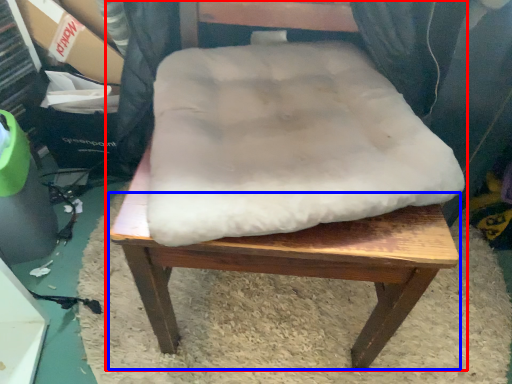
Question: Which point is closer to the camera, chair (highlighted by a red box) or step stool (highlighted by a blue box)?

Choices:
 (A) chair
 (B) step stool

Answer: (A)